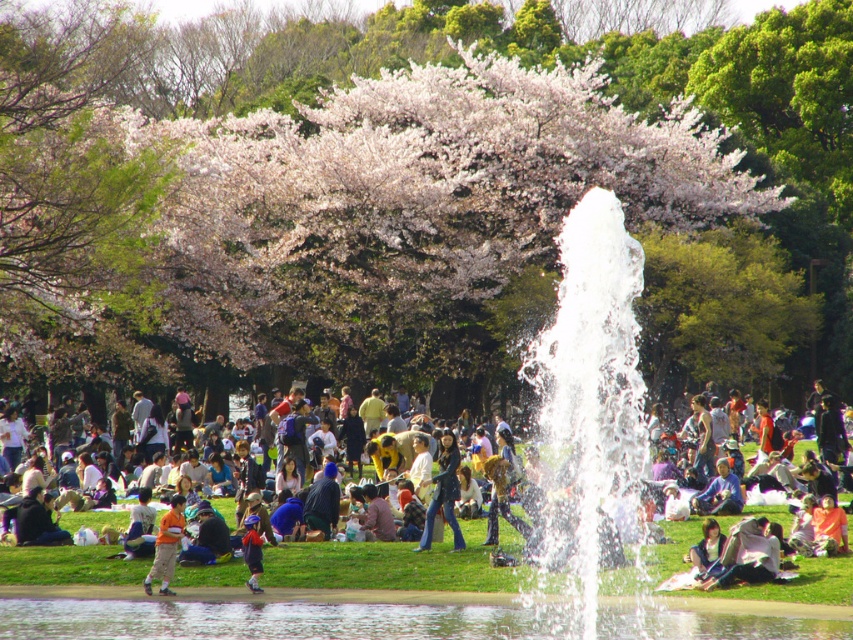
Question: Is orange cotton shirt at lower left thinner than blue denim jacket at lower center?

Choices:
 (A) yes
 (B) no

Answer: (B)

Question: Where is denim jeans at center located in relation to orange cotton shirt at lower left in the image?

Choices:
 (A) left
 (B) right

Answer: (B)

Question: Based on their relative distances, which object is farther from the white frothy water at center?

Choices:
 (A) blue denim jacket at lower center
 (B) orange cotton shirt at lower left

Answer: (A)

Question: Which point is closer to the camera?

Choices:
 (A) blue denim jacket at lower center
 (B) denim jeans at center
 (C) transparent glass water at center

Answer: (C)

Question: Does white blossoming tree at upper center have a larger size compared to denim jeans at center?

Choices:
 (A) no
 (B) yes

Answer: (B)

Question: Among these points, which one is farthest from the camera?

Choices:
 (A) (520, 541)
 (B) (425, 545)
 (C) (149, 589)
 (D) (258, 564)

Answer: (A)